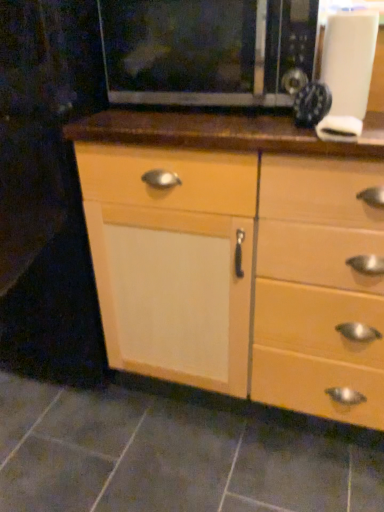
Identify the location of vacant area to the left of white matte knob at upper right. (263, 130).